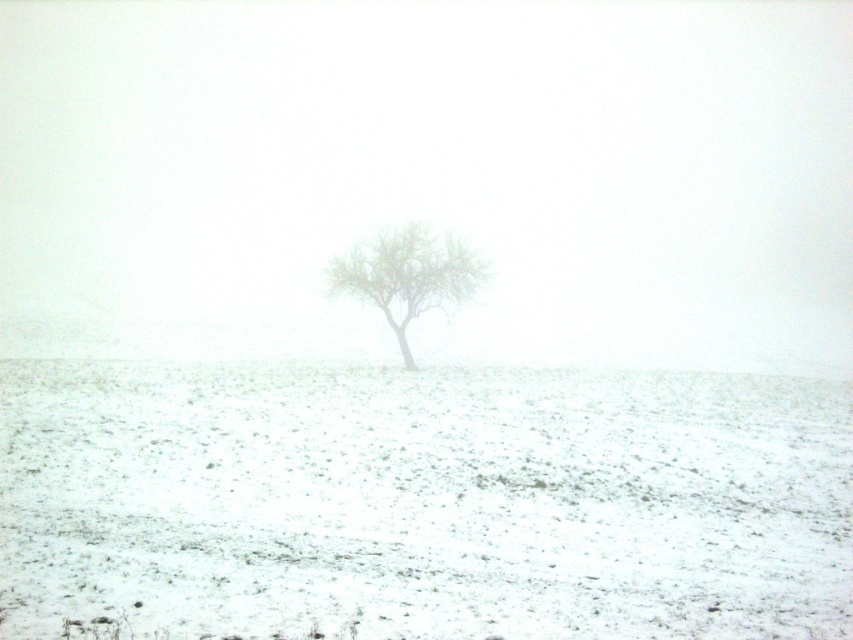
Question: Which of the following is the closest to the observer?

Choices:
 (A) white snow at center
 (B) green leafy tree at center

Answer: (A)

Question: From the image, what is the correct spatial relationship of white snow at center in relation to green leafy tree at center?

Choices:
 (A) left
 (B) right

Answer: (A)

Question: Does white snow at center have a smaller size compared to green leafy tree at center?

Choices:
 (A) yes
 (B) no

Answer: (B)

Question: Is white snow at center to the left of green leafy tree at center from the viewer's perspective?

Choices:
 (A) yes
 (B) no

Answer: (A)

Question: Which of the following is the closest to the observer?

Choices:
 (A) white snow at center
 (B) green leafy tree at center

Answer: (A)